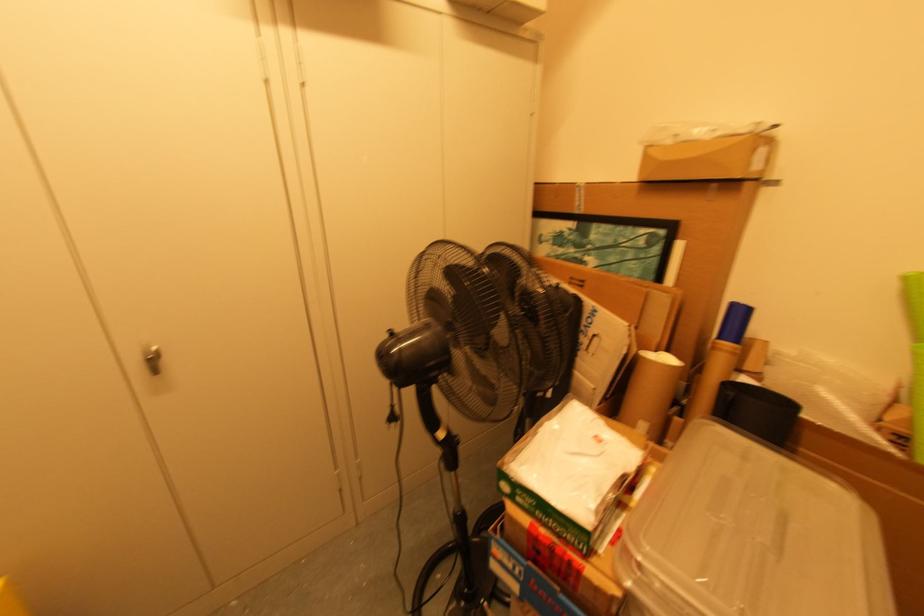
What do you see at coordinates (152, 359) in the screenshot?
I see `the silver cabinet knob` at bounding box center [152, 359].